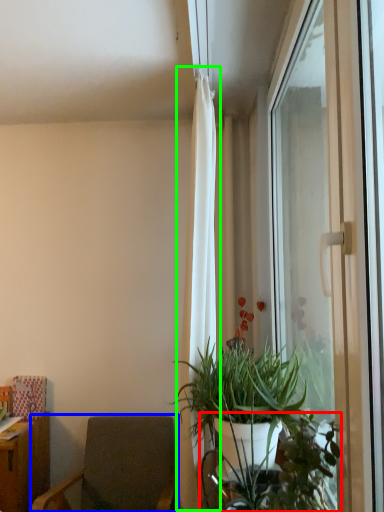
Question: Which object is the closest to the vegetation (highlighted by a red box)? Choose among these: chair (highlighted by a blue box) or curtain (highlighted by a green box).

Choices:
 (A) chair
 (B) curtain

Answer: (B)